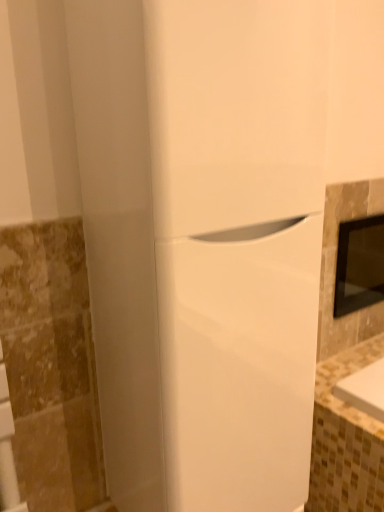
Question: Is black glass medicine cabinet at right shorter than white glossy refrigerator at center?

Choices:
 (A) no
 (B) yes

Answer: (B)

Question: Is black glass medicine cabinet at right aimed at white glossy refrigerator at center?

Choices:
 (A) no
 (B) yes

Answer: (A)

Question: Would you say white glossy refrigerator at center is part of black glass medicine cabinet at right's contents?

Choices:
 (A) yes
 (B) no

Answer: (B)

Question: Considering the relative sizes of black glass medicine cabinet at right and white glossy refrigerator at center in the image provided, is black glass medicine cabinet at right smaller than white glossy refrigerator at center?

Choices:
 (A) no
 (B) yes

Answer: (B)

Question: Is black glass medicine cabinet at right in front of white glossy refrigerator at center?

Choices:
 (A) no
 (B) yes

Answer: (A)

Question: Are black glass medicine cabinet at right and white glossy refrigerator at center making contact?

Choices:
 (A) no
 (B) yes

Answer: (A)

Question: Are white glossy refrigerator at center and black glass medicine cabinet at right located far from each other?

Choices:
 (A) no
 (B) yes

Answer: (A)

Question: From a real-world perspective, is white glossy refrigerator at center located higher than black glass medicine cabinet at right?

Choices:
 (A) yes
 (B) no

Answer: (A)

Question: Is white glossy refrigerator at center oriented towards black glass medicine cabinet at right?

Choices:
 (A) yes
 (B) no

Answer: (B)

Question: Is white glossy refrigerator at center positioned in front of black glass medicine cabinet at right?

Choices:
 (A) yes
 (B) no

Answer: (A)

Question: Does white glossy refrigerator at center have a greater height compared to black glass medicine cabinet at right?

Choices:
 (A) yes
 (B) no

Answer: (A)

Question: From the image's perspective, is white glossy refrigerator at center on black glass medicine cabinet at right?

Choices:
 (A) no
 (B) yes

Answer: (A)

Question: From the image's perspective, is white glossy refrigerator at center above or below black glass medicine cabinet at right?

Choices:
 (A) below
 (B) above

Answer: (A)